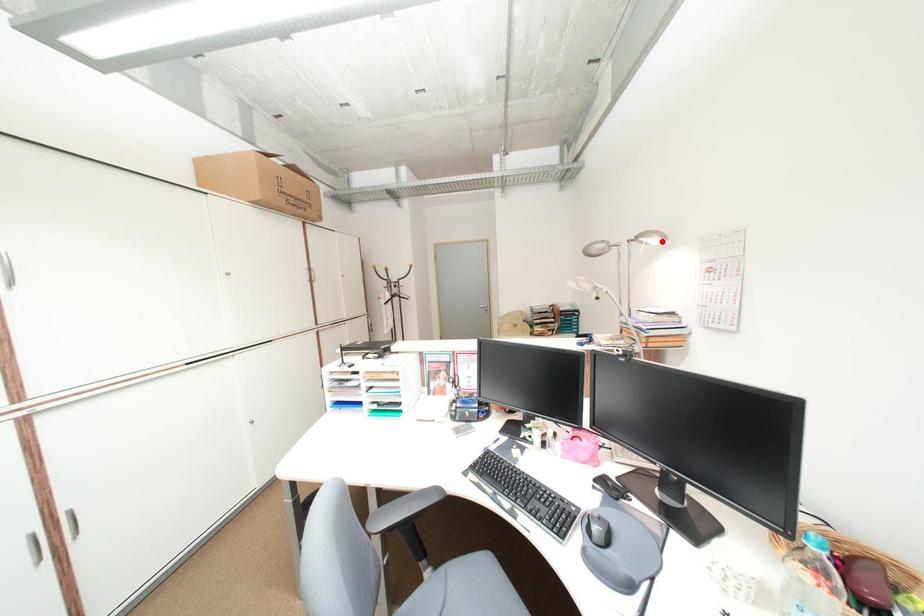
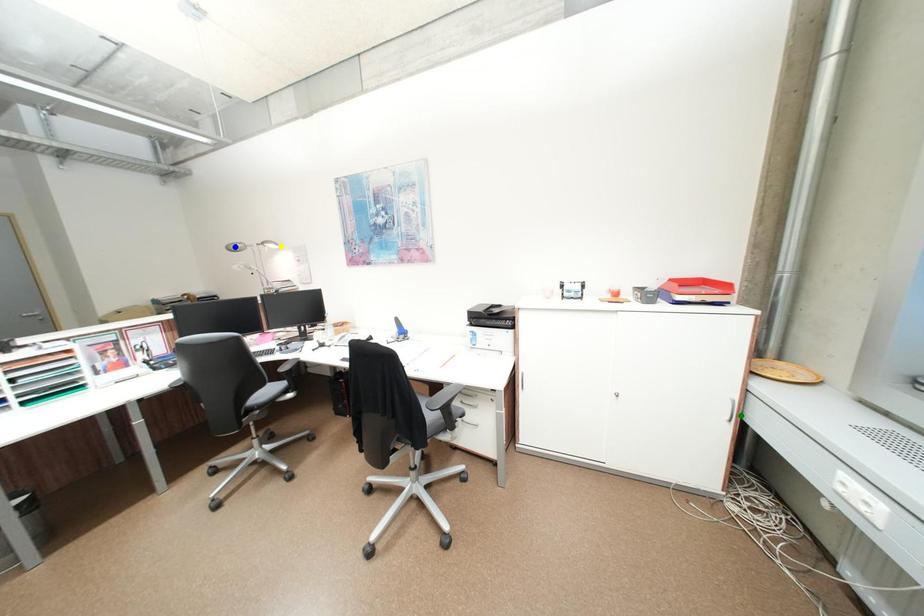
Question: I am providing you with two images of the same scene from different viewpoints. A red point is marked on the first image. You are given multiple points on the second image. Which point in image 2 represents the same 3d spot as the red point in image 1?

Choices:
 (A) blue point
 (B) green point
 (C) yellow point

Answer: (C)